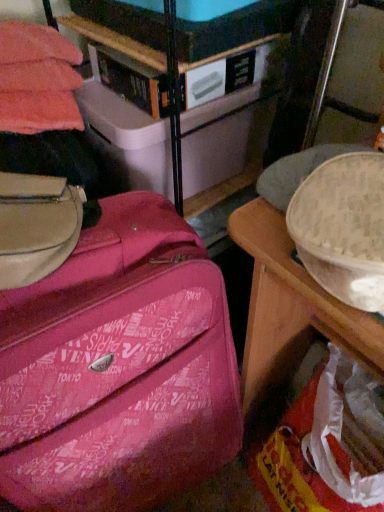
Question: From the image's perspective, is pink fabric suitcase at center located above or below matte white storage box at upper center?

Choices:
 (A) above
 (B) below

Answer: (B)

Question: Would you say pink fabric suitcase at center is to the left or to the right of matte white storage box at upper center in the picture?

Choices:
 (A) left
 (B) right

Answer: (A)

Question: Which is correct: pink fabric suitcase at center is inside matte white storage box at upper center, or outside of it?

Choices:
 (A) outside
 (B) inside

Answer: (A)

Question: From the image's perspective, is matte white storage box at upper center positioned above or below pink fabric suitcase at center?

Choices:
 (A) above
 (B) below

Answer: (A)

Question: Based on their sizes in the image, would you say matte white storage box at upper center is bigger or smaller than pink fabric suitcase at center?

Choices:
 (A) big
 (B) small

Answer: (B)

Question: Considering the positions of matte white storage box at upper center and pink fabric suitcase at center in the image, is matte white storage box at upper center wider or thinner than pink fabric suitcase at center?

Choices:
 (A) wide
 (B) thin

Answer: (B)

Question: In the image, is matte white storage box at upper center positioned in front of or behind pink fabric suitcase at center?

Choices:
 (A) front
 (B) behind

Answer: (B)